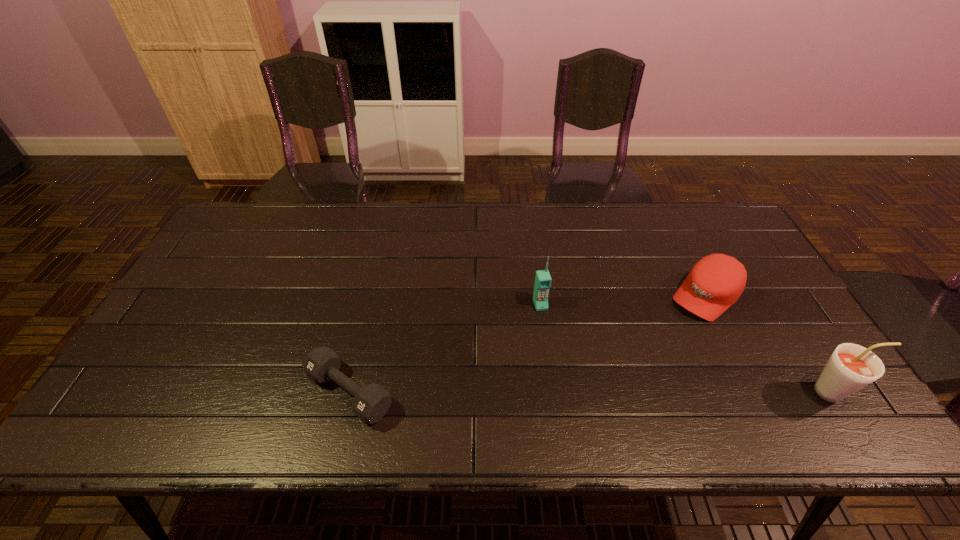
In order to click on free space between the second object from left to right and the shortest object in this screenshot , I will do `click(444, 348)`.

At what (x,y) coordinates should I click in order to perform the action: click on empty space between the second object from left to right and the second object from right to left. Please return your answer as a coordinate pair (x, y). The image size is (960, 540). Looking at the image, I should click on (623, 300).

This screenshot has height=540, width=960. Identify the location of free space between the rightmost object and the cellular telephone. (687, 348).

Identify the location of object that is the closest to the third tallest object. This screenshot has height=540, width=960. (851, 367).

I want to click on object that is the third nearest to the dumbbell, so click(851, 367).

Where is `free space that satisfies the following two spatial constraints: 1. on the back side of the dumbbell; 2. on the drink side of the root beer`? free space that satisfies the following two spatial constraints: 1. on the back side of the dumbbell; 2. on the drink side of the root beer is located at coordinates (349, 392).

Locate an element on the screen. blank space that satisfies the following two spatial constraints: 1. on the back side of the third object from left to right; 2. on the left side of the second object from left to right is located at coordinates (540, 296).